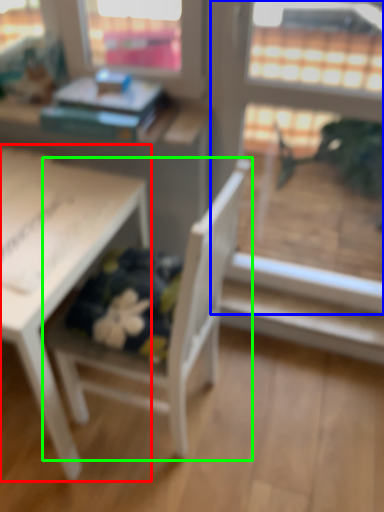
Question: Considering the real-world distances, which object is closest to table (highlighted by a red box)? screen door (highlighted by a blue box) or chair (highlighted by a green box).

Choices:
 (A) screen door
 (B) chair

Answer: (B)